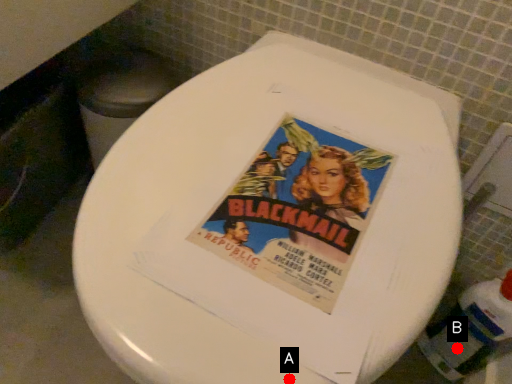
Question: Two points are circled on the image, labeled by A and B beside each circle. Which point appears farthest from the camera in this image?

Choices:
 (A) A is further
 (B) B is further

Answer: (B)